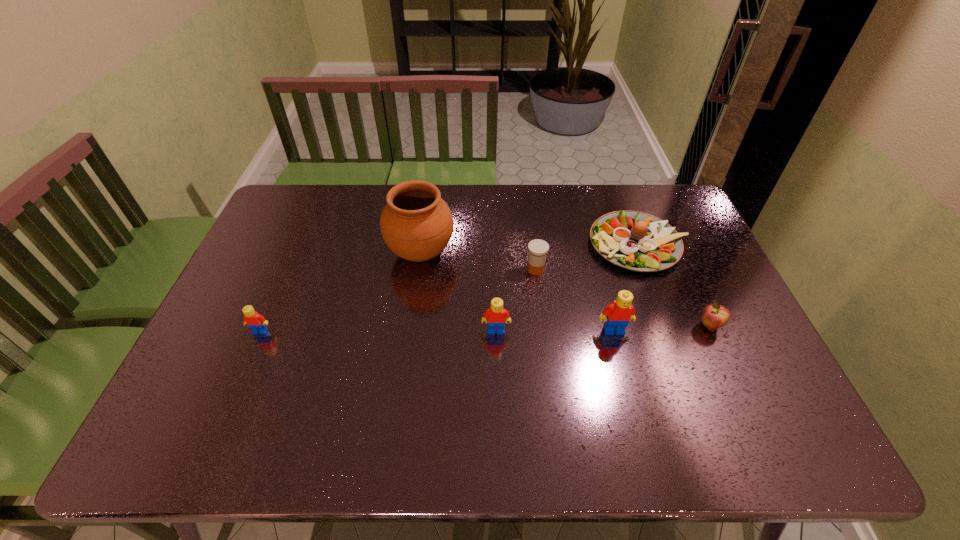
Locate an element on the screen. The width and height of the screenshot is (960, 540). free space between the tallest object and the medicine is located at coordinates (478, 261).

Find the location of a particular element. The height and width of the screenshot is (540, 960). unoccupied position between the salad plate and the fourth object from right to left is located at coordinates (587, 257).

Where is `empty space that is in between the leftmost Lego and the second object from left to right`? The image size is (960, 540). empty space that is in between the leftmost Lego and the second object from left to right is located at coordinates (341, 292).

Identify the location of unoccupied position between the apple and the salad plate. The width and height of the screenshot is (960, 540). (674, 286).

At what (x,y) coordinates should I click in order to perform the action: click on free area in between the tallest Lego and the apple. Please return your answer as a coordinate pair (x, y). Looking at the image, I should click on (661, 328).

At what (x,y) coordinates should I click in order to perform the action: click on vacant region between the shortest Lego and the third tallest object. Please return your answer as a coordinate pair (x, y). The width and height of the screenshot is (960, 540). Looking at the image, I should click on (378, 331).

Locate an element on the screen. This screenshot has height=540, width=960. free point between the leftmost Lego and the fourth object from left to right is located at coordinates (398, 301).

Find the location of a particular element. vacant point located between the rightmost Lego and the apple is located at coordinates (661, 328).

You are a GUI agent. You are given a task and a screenshot of the screen. Output one action in this format:
    pyautogui.click(x=<x>, y=<y>)
    Task: Click on the vacant area that lies between the second object from left to right and the medicine
    
    Given the screenshot: What is the action you would take?
    pyautogui.click(x=478, y=261)

The width and height of the screenshot is (960, 540). In order to click on the closest object to the apple in this screenshot , I will do `click(637, 241)`.